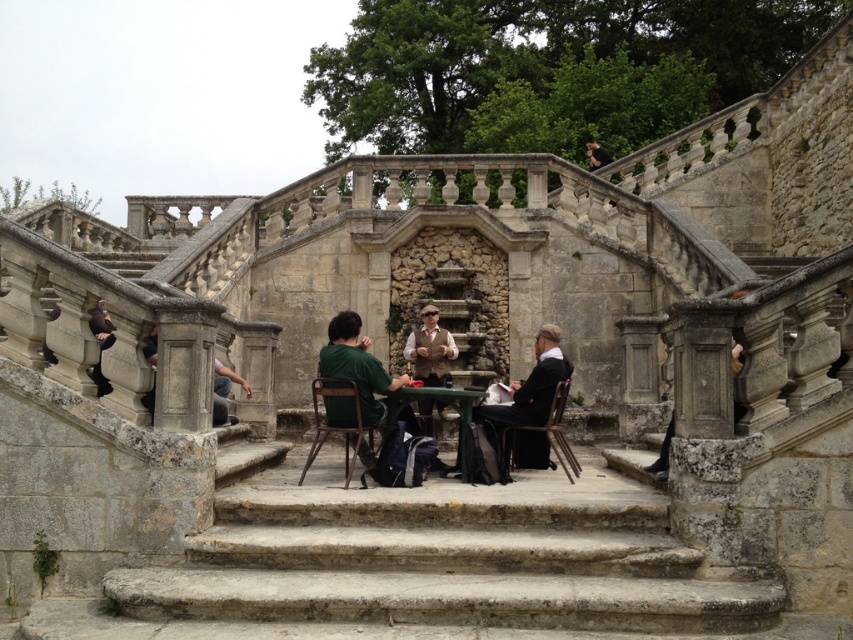
Question: Can you confirm if green fabric shirt at center is smaller than green matte table at center?

Choices:
 (A) yes
 (B) no

Answer: (B)

Question: Considering the relative positions of green fabric shirt at center and green matte table at center in the image provided, where is green fabric shirt at center located with respect to green matte table at center?

Choices:
 (A) left
 (B) right

Answer: (A)

Question: Estimate the real-world distances between objects in this image. Which object is farther from the green matte table at center?

Choices:
 (A) green fabric shirt at center
 (B) dark suit at center

Answer: (B)

Question: Estimate the real-world distances between objects in this image. Which object is closer to the green matte table at center?

Choices:
 (A) dark suit at center
 (B) green fabric shirt at center

Answer: (B)

Question: Can you confirm if dark suit at center is positioned to the right of green matte table at center?

Choices:
 (A) yes
 (B) no

Answer: (A)

Question: Considering the real-world distances, which object is farthest from the green matte table at center?

Choices:
 (A) dark suit at center
 (B) green fabric shirt at center

Answer: (A)